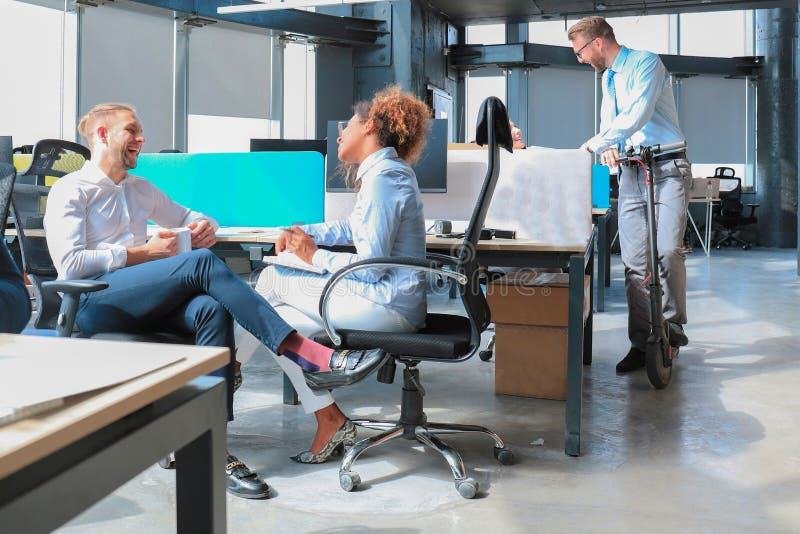
The image size is (800, 534). I want to click on man sitting in chair, so click(x=110, y=108), click(x=69, y=239), click(x=192, y=210), click(x=242, y=302), click(x=350, y=363), click(x=246, y=470).